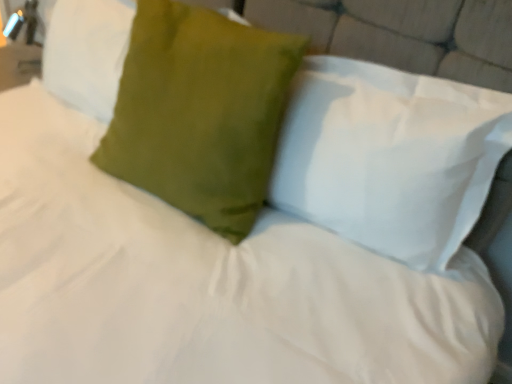
Find the location of a particular element. satin green pillow at upper left, the 1th pillow from the left is located at coordinates 87,53.

Is satin green pillow at upper left, the 1th pillow from the left, bigger or smaller than matte green pillow at upper center, which appears as the third pillow when viewed from the left?

Considering their sizes, satin green pillow at upper left, the 1th pillow from the left, takes up less space than matte green pillow at upper center, which appears as the third pillow when viewed from the left.

Are satin green pillow at upper left, the 1th pillow from the left, and matte green pillow at upper center, which appears as the third pillow when viewed from the left, far apart?

satin green pillow at upper left, the 1th pillow from the left, is near matte green pillow at upper center, which appears as the third pillow when viewed from the left, not far away.

Can you confirm if satin green pillow at upper left, which is the third pillow in right-to-left order, is positioned to the left of matte green pillow at upper center, which appears as the third pillow when viewed from the left?

Yes.

Is point (329, 227) closer or farther from the camera than point (66, 80)?

Clearly, point (329, 227) is closer to the camera than point (66, 80).

Considering the sizes of objects matte green pillow at upper center, the first pillow in the right-to-left sequence, and satin green pillow at upper left, which is the third pillow in right-to-left order, in the image provided, who is smaller, matte green pillow at upper center, the first pillow in the right-to-left sequence, or satin green pillow at upper left, which is the third pillow in right-to-left order,?

satin green pillow at upper left, which is the third pillow in right-to-left order.

Is matte green pillow at upper center, the first pillow in the right-to-left sequence, inside the boundaries of satin green pillow at upper left, the 1th pillow from the left, or outside?

matte green pillow at upper center, the first pillow in the right-to-left sequence, is located beyond the bounds of satin green pillow at upper left, the 1th pillow from the left.

Looking at this image, from a real-world perspective, is matte green pillow at upper center, the first pillow in the right-to-left sequence, on top of satin green pillow at upper left, the 1th pillow from the left?

Yes, from a real-world perspective, matte green pillow at upper center, the first pillow in the right-to-left sequence, is over satin green pillow at upper left, the 1th pillow from the left

From the image's perspective, would you say satin green pillow at center, the second pillow from the left, is positioned over matte green pillow at upper center, which appears as the third pillow when viewed from the left?

Correct, satin green pillow at center, the second pillow from the left, appears higher than matte green pillow at upper center, which appears as the third pillow when viewed from the left, in the image.

Is satin green pillow at center, which ranks as the second pillow in right-to-left order, further to camera compared to matte green pillow at upper center, the first pillow in the right-to-left sequence?

Yes, it is behind matte green pillow at upper center, the first pillow in the right-to-left sequence.

How different are the orientations of satin green pillow at center, which ranks as the second pillow in right-to-left order, and matte green pillow at upper center, the first pillow in the right-to-left sequence, in degrees?

satin green pillow at center, which ranks as the second pillow in right-to-left order, and matte green pillow at upper center, the first pillow in the right-to-left sequence, are facing 3.31 degrees away from each other.

Considering the positions of objects satin green pillow at center, the second pillow from the left, and matte green pillow at upper center, the first pillow in the right-to-left sequence, in the image provided, who is more to the left, satin green pillow at center, the second pillow from the left, or matte green pillow at upper center, the first pillow in the right-to-left sequence,?

Positioned to the left is satin green pillow at center, the second pillow from the left.

Choose the correct answer: Is satin green pillow at upper left, which is the third pillow in right-to-left order, inside satin green pillow at center, the second pillow from the left, or outside it?

satin green pillow at upper left, which is the third pillow in right-to-left order, cannot be found inside satin green pillow at center, the second pillow from the left.

Is satin green pillow at upper left, the 1th pillow from the left, to the right of satin green pillow at center, which ranks as the second pillow in right-to-left order, from the viewer's perspective?

No, satin green pillow at upper left, the 1th pillow from the left, is not to the right of satin green pillow at center, which ranks as the second pillow in right-to-left order.

Is satin green pillow at upper left, which is the third pillow in right-to-left order, closer to camera compared to satin green pillow at center, which ranks as the second pillow in right-to-left order?

No, satin green pillow at upper left, which is the third pillow in right-to-left order, is further to the viewer.

Is satin green pillow at upper left, which is the third pillow in right-to-left order, placed right next to satin green pillow at center, the second pillow from the left?

No, satin green pillow at upper left, which is the third pillow in right-to-left order, is not next to satin green pillow at center, the second pillow from the left.

Can you confirm if satin green pillow at center, which ranks as the second pillow in right-to-left order, is thinner than satin green pillow at upper left, the 1th pillow from the left?

No, satin green pillow at center, which ranks as the second pillow in right-to-left order, is not thinner than satin green pillow at upper left, the 1th pillow from the left.

Measure the distance from satin green pillow at center, the second pillow from the left, to satin green pillow at upper left, which is the third pillow in right-to-left order.

satin green pillow at center, the second pillow from the left, and satin green pillow at upper left, which is the third pillow in right-to-left order, are 13.13 inches apart from each other.

From the image's perspective, is satin green pillow at center, the second pillow from the left, on satin green pillow at upper left, the 1th pillow from the left?

Incorrect, from the image's perspective, satin green pillow at center, the second pillow from the left, is lower than satin green pillow at upper left, the 1th pillow from the left.

Do you think satin green pillow at center, which ranks as the second pillow in right-to-left order, is within satin green pillow at upper left, which is the third pillow in right-to-left order, or outside of it?

satin green pillow at center, which ranks as the second pillow in right-to-left order, cannot be found inside satin green pillow at upper left, which is the third pillow in right-to-left order.

From the picture: Does matte green pillow at upper center, the first pillow in the right-to-left sequence, have a larger size compared to satin green pillow at center, the second pillow from the left?

No, matte green pillow at upper center, the first pillow in the right-to-left sequence, is not bigger than satin green pillow at center, the second pillow from the left.

Considering the sizes of objects matte green pillow at upper center, which appears as the third pillow when viewed from the left, and satin green pillow at center, the second pillow from the left, in the image provided, who is wider, matte green pillow at upper center, which appears as the third pillow when viewed from the left, or satin green pillow at center, the second pillow from the left,?

Wider between the two is satin green pillow at center, the second pillow from the left.

Can you see matte green pillow at upper center, the first pillow in the right-to-left sequence, touching satin green pillow at center, the second pillow from the left?

No, matte green pillow at upper center, the first pillow in the right-to-left sequence, is not with satin green pillow at center, the second pillow from the left.

Choose the correct answer: Is matte green pillow at upper center, the first pillow in the right-to-left sequence, inside satin green pillow at center, the second pillow from the left, or outside it?

matte green pillow at upper center, the first pillow in the right-to-left sequence, is spatially situated outside satin green pillow at center, the second pillow from the left.

From the satin green pillow at upper left, which is the third pillow in right-to-left order, count 2nd pillow to the right and point to it. Please provide its 2D coordinates.

[(389, 156)]

There is a matte green pillow at upper center, the first pillow in the right-to-left sequence. In order to click on the 2nd pillow above it (from the image's perspective) in this screenshot , I will do `click(87, 53)`.

From the image, which object appears to be nearer to satin green pillow at upper left, the 1th pillow from the left, matte green pillow at upper center, which appears as the third pillow when viewed from the left, or satin green pillow at center, the second pillow from the left?

The object closer to satin green pillow at upper left, the 1th pillow from the left, is satin green pillow at center, the second pillow from the left.

Looking at the image, which one is located closer to satin green pillow at center, the second pillow from the left, matte green pillow at upper center, which appears as the third pillow when viewed from the left, or satin green pillow at upper left, the 1th pillow from the left?

The object closer to satin green pillow at center, the second pillow from the left, is matte green pillow at upper center, which appears as the third pillow when viewed from the left.

Based on their spatial positions, is satin green pillow at upper left, the 1th pillow from the left, or matte green pillow at upper center, which appears as the third pillow when viewed from the left, further from satin green pillow at center, the second pillow from the left?

satin green pillow at upper left, the 1th pillow from the left, is further to satin green pillow at center, the second pillow from the left.

Looking at the image, which one is located closer to matte green pillow at upper center, the first pillow in the right-to-left sequence, satin green pillow at upper left, the 1th pillow from the left, or satin green pillow at center, the second pillow from the left?

Among the two, satin green pillow at center, the second pillow from the left, is located nearer to matte green pillow at upper center, the first pillow in the right-to-left sequence.

Based on the photo, based on their spatial positions, is satin green pillow at center, the second pillow from the left, or matte green pillow at upper center, which appears as the third pillow when viewed from the left, further from satin green pillow at upper left, the 1th pillow from the left?

matte green pillow at upper center, which appears as the third pillow when viewed from the left, is further to satin green pillow at upper left, the 1th pillow from the left.

From the picture: From the image, which object appears to be nearer to matte green pillow at upper center, which appears as the third pillow when viewed from the left, satin green pillow at center, which ranks as the second pillow in right-to-left order, or satin green pillow at upper left, the 1th pillow from the left?

satin green pillow at center, which ranks as the second pillow in right-to-left order.

Locate an element on the screen. The image size is (512, 384). pillow between satin green pillow at upper left, the 1th pillow from the left, and matte green pillow at upper center, the first pillow in the right-to-left sequence is located at coordinates (200, 112).